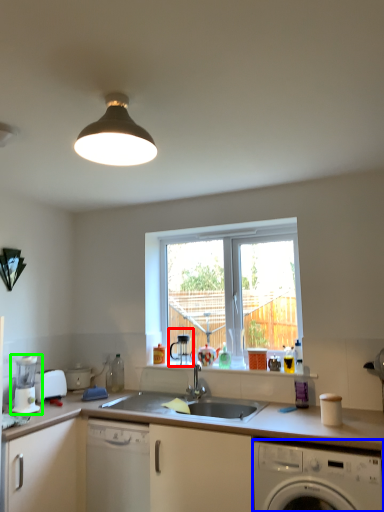
Question: Which is farther away from coffee machine (highlighted by a red box)? washing machine (highlighted by a blue box) or coffee machine (highlighted by a green box)?

Choices:
 (A) washing machine
 (B) coffee machine

Answer: (A)